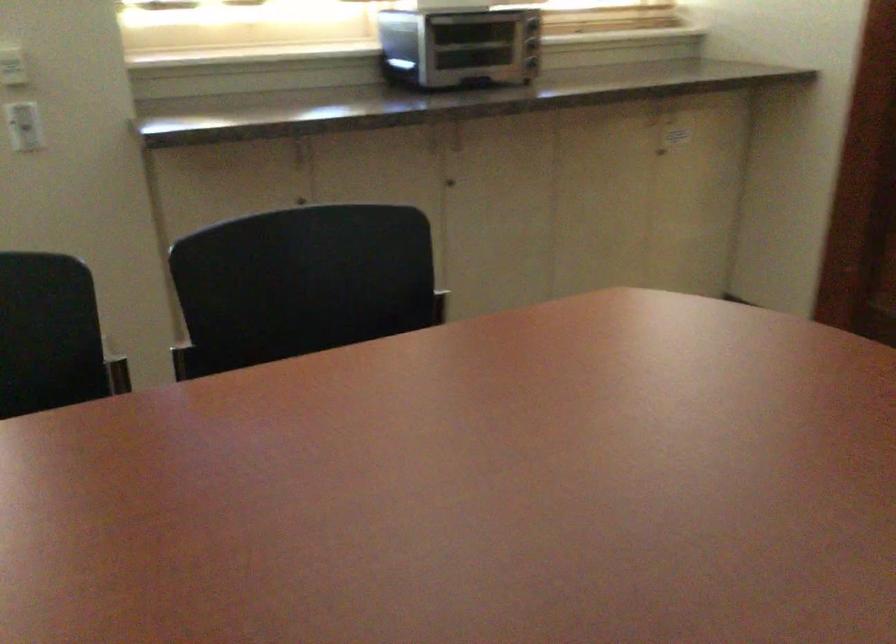
This screenshot has width=896, height=644. Describe the element at coordinates (460, 46) in the screenshot. I see `the toaster oven handle` at that location.